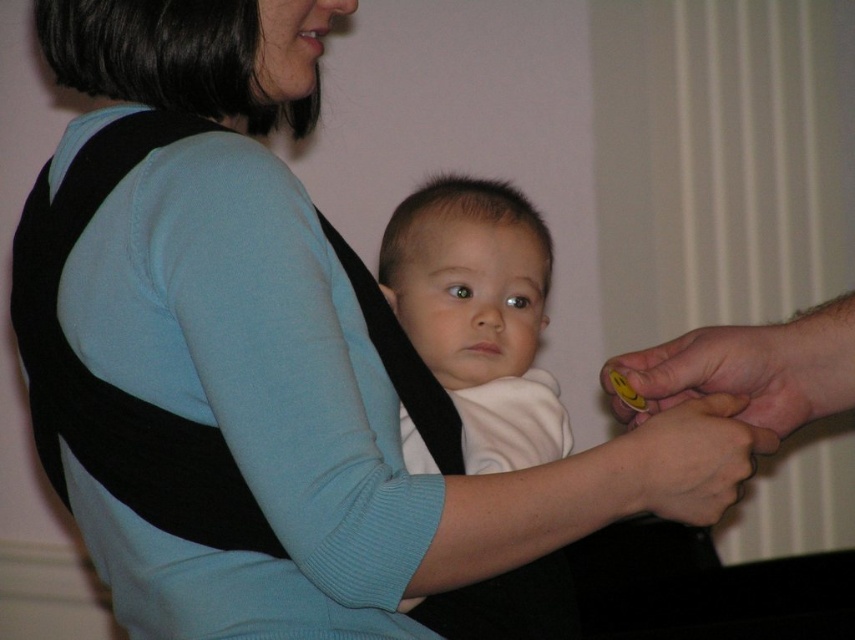
In the scene shown: You are a photographer standing in front of the scene. You need to take a photo of the white soft baby at center. The other person is holding a camera 31.04 inches away from the baby. Can you get a clearer photo by moving closer?

The other person is holding a camera 31.04 inches away from the white soft baby at center. Moving closer would allow you to capture more details, so yes, you can get a clearer photo by moving closer.

You are a photographer setting up for a family photo. You notice the yellow rubber ring at right and the smooth skin hand at lower right in the scene. Which object is positioned higher from the ground?

The yellow rubber ring at right is above the smooth skin hand at lower right, so the yellow rubber ring at right is higher from the ground.